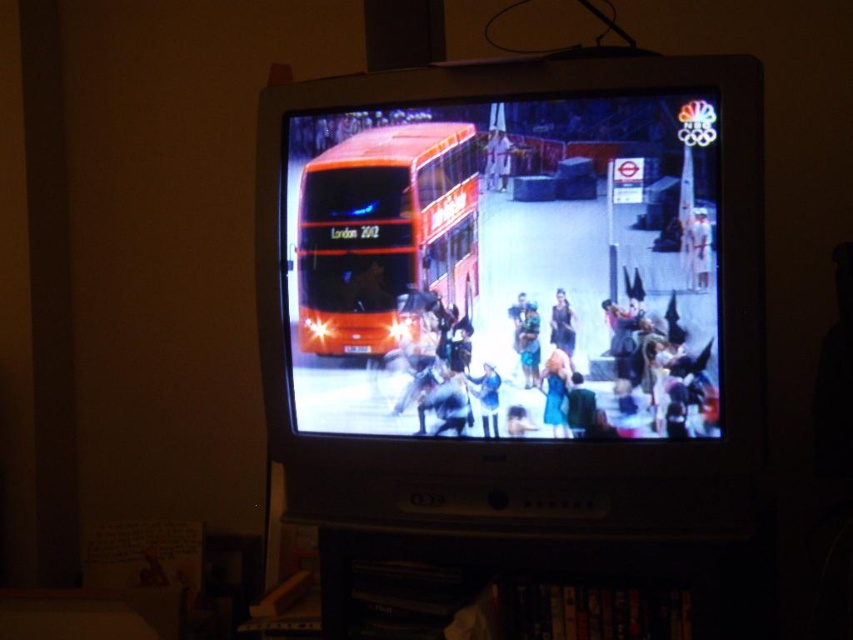
You are a fashion designer who needs to place a 5 inch wide accessory between the matte black dress at center and the black satin dress at center. Is there enough space?

The matte black dress at center and the black satin dress at center are 4.58 inches apart. Since the accessory is 5 inches wide, it won not fit between them.

Consider the image. You are a fashion designer who wants to showcase a new dress design. You have a matte black dress at center and a shiny orange bus at center in the image. Which object is larger and would be more suitable for highlighting the dress?

The matte black dress at center is bigger than the shiny orange bus at center, making it more suitable for highlighting the dress as it occupies more visual space in the image.

You are a fashion designer who wants to choose a dress for a runway show. You have two options in front of you on the screen of the CRT television in the dimly lit room. Which dress is larger in size between the matte black dress at center and the black satin dress at center?

The matte black dress at center is bigger than the black satin dress at center, so the matte black dress at center is the larger option for the runway show.